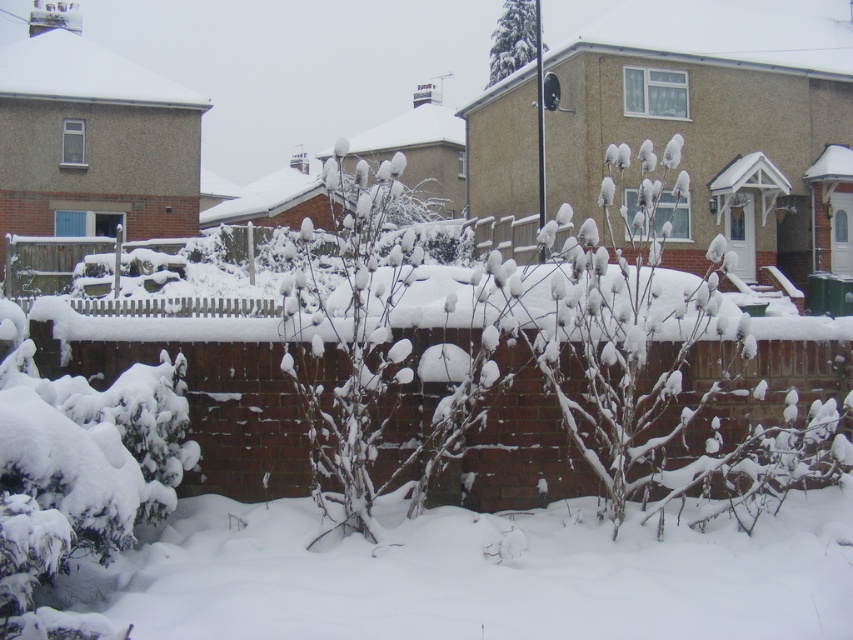
You are standing at the point marked as point (78, 472) in the snowy residential scene. Looking around, you see a snow covered bush at lower left and a wooden fence behind the brick wall. Which object is closer to your current position?

The snow covered bush at lower left is closer to your current position because the point (78, 472) is on it, meaning you are directly on the bush.